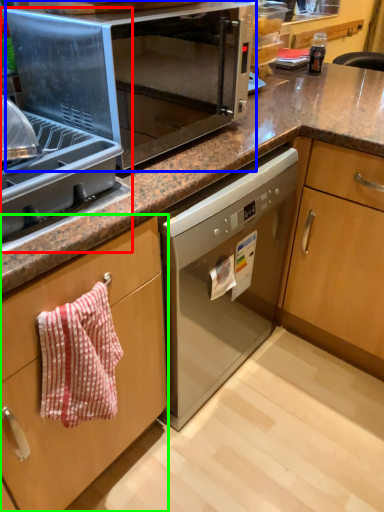
Question: Considering the real-world distances, which object is closest to appliance (highlighted by a red box)? microwave oven (highlighted by a blue box) or cabinetry (highlighted by a green box).

Choices:
 (A) microwave oven
 (B) cabinetry

Answer: (A)